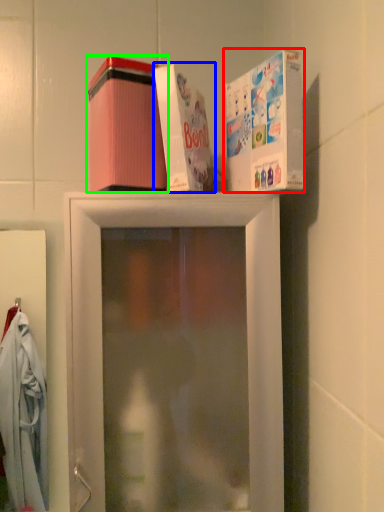
Question: Based on their relative distances, which object is nearer to box (highlighted by a red box)? Choose from box (highlighted by a blue box) and box (highlighted by a green box).

Choices:
 (A) box
 (B) box

Answer: (A)